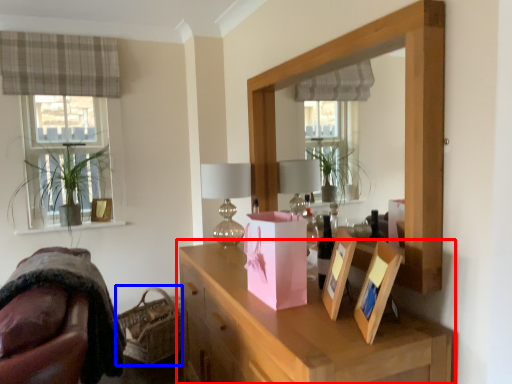
Question: Which of the following is the closest to the observer, cabinetry (highlighted by a red box) or basket (highlighted by a blue box)?

Choices:
 (A) cabinetry
 (B) basket

Answer: (A)